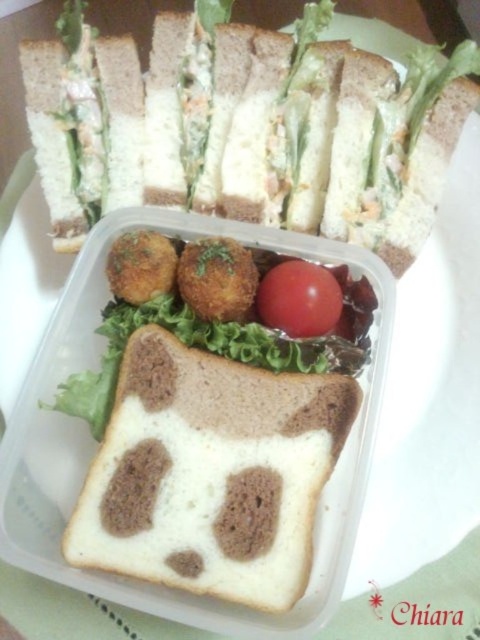
Question: Does white bread with brown filling at center appear on the right side of white soft bread at center?

Choices:
 (A) no
 (B) yes

Answer: (B)

Question: Which object is farther from the camera taking this photo?

Choices:
 (A) white soft bread at center
 (B) white bread with brown filling at center

Answer: (B)

Question: Can you confirm if white bread with brown filling at center is positioned to the left of red smooth tomato at center?

Choices:
 (A) no
 (B) yes

Answer: (B)

Question: Where is white soft bread at center located in relation to red smooth tomato at center in the image?

Choices:
 (A) above
 (B) below

Answer: (B)

Question: Which object appears closest to the camera in this image?

Choices:
 (A) red smooth tomato at center
 (B) white bread with brown filling at center
 (C) white soft bread at center

Answer: (C)

Question: Among these objects, which one is nearest to the camera?

Choices:
 (A) red smooth tomato at center
 (B) white bread with brown filling at center
 (C) white soft bread at center

Answer: (C)